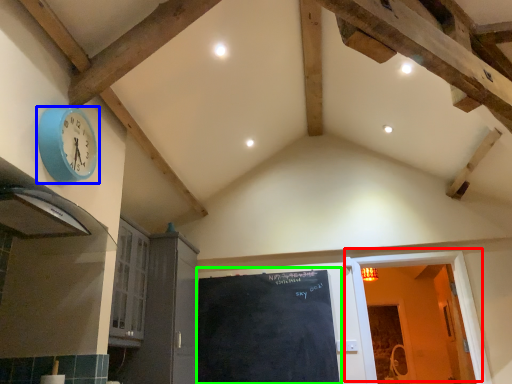
Question: Based on their relative distances, which object is farther from door (highlighted by a red box)? Choose from wall clock (highlighted by a blue box) and bulletin board (highlighted by a green box).

Choices:
 (A) wall clock
 (B) bulletin board

Answer: (A)